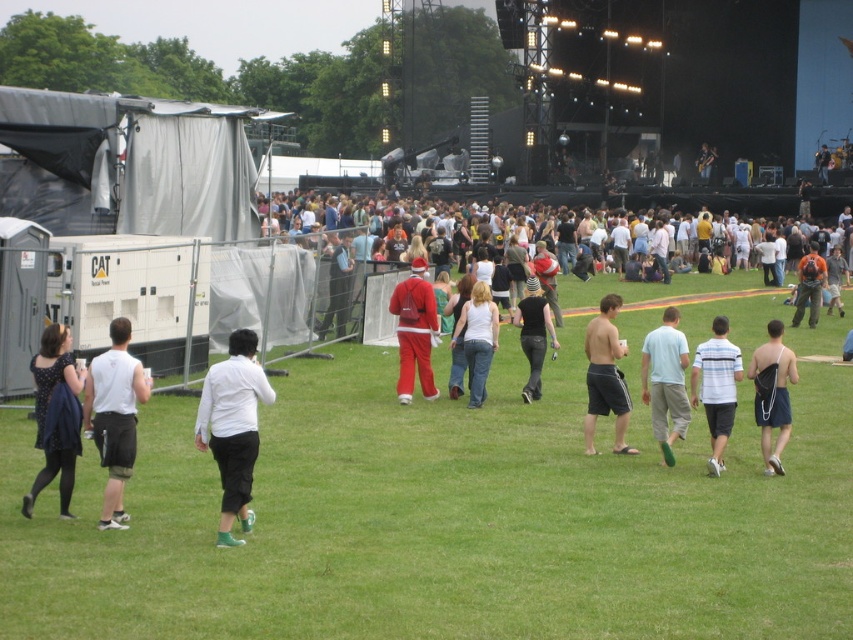
Does white matte shirt at center appear over light blue cotton shirt at center?

Actually, white matte shirt at center is below light blue cotton shirt at center.

Does white matte shirt at center have a larger size compared to light blue cotton shirt at center?

No, white matte shirt at center is not bigger than light blue cotton shirt at center.

Between point (229, 342) and point (676, 352), which one is positioned behind?

Positioned behind is point (676, 352).

Find the location of a particular element. white matte shirt at center is located at coordinates (233, 428).

Looking at this image, does white matte shirt at center have a larger size compared to black matte pants at center?

Correct, white matte shirt at center is larger in size than black matte pants at center.

Does white matte shirt at center have a smaller size compared to black matte pants at center?

Incorrect, white matte shirt at center is not smaller in size than black matte pants at center.

Is point (254, 406) positioned before point (543, 314)?

That is True.

At what (x,y) coordinates should I click in order to perform the action: click on white matte shirt at center. Please return your answer as a coordinate pair (x, y). The image size is (853, 640). Looking at the image, I should click on (233, 428).

Can you confirm if white matte shirt at center is positioned to the right of shiny black shorts at center?

Incorrect, white matte shirt at center is not on the right side of shiny black shorts at center.

Can you confirm if white matte shirt at center is positioned to the left of shiny black shorts at center?

Correct, you'll find white matte shirt at center to the left of shiny black shorts at center.

Locate an element on the screen. This screenshot has width=853, height=640. white matte shirt at center is located at coordinates (233, 428).